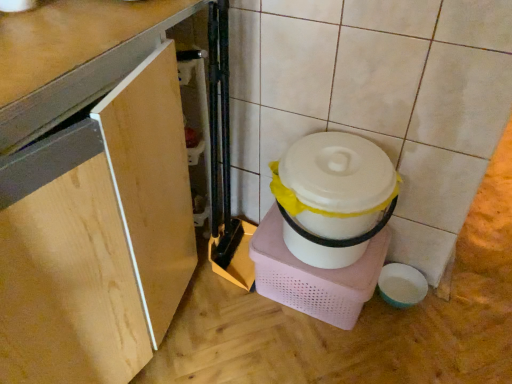
What do you see at coordinates (91, 190) in the screenshot? Image resolution: width=512 pixels, height=384 pixels. I see `wooden cabinet at lower left` at bounding box center [91, 190].

This screenshot has width=512, height=384. I want to click on wooden cabinet at lower left, so click(91, 190).

What do you see at coordinates (333, 196) in the screenshot?
I see `white plastic container at center-right` at bounding box center [333, 196].

Where is `white plastic container at center-right`? The height and width of the screenshot is (384, 512). white plastic container at center-right is located at coordinates (333, 196).

In order to click on wooden cabinet at lower left in this screenshot , I will do `click(91, 190)`.

Between white plastic container at center-right and wooden cabinet at lower left, which one appears on the left side from the viewer's perspective?

wooden cabinet at lower left is more to the left.

Which object is more forward, white plastic container at center-right or wooden cabinet at lower left?

wooden cabinet at lower left is more forward.

Between point (324, 140) and point (181, 136), which one is positioned behind?

The point (324, 140) is behind.

From the image's perspective, is white plastic container at center-right positioned above or below wooden cabinet at lower left?

Based on their image positions, white plastic container at center-right is located beneath wooden cabinet at lower left.

From a real-world perspective, is white plastic container at center-right physically above wooden cabinet at lower left?

No.

Looking at their sizes, would you say white plastic container at center-right is wider or thinner than wooden cabinet at lower left?

In the image, white plastic container at center-right appears to be more narrow than wooden cabinet at lower left.

From their relative heights in the image, would you say white plastic container at center-right is taller or shorter than wooden cabinet at lower left?

Clearly, white plastic container at center-right is shorter compared to wooden cabinet at lower left.

Considering the sizes of white plastic container at center-right and wooden cabinet at lower left in the image, is white plastic container at center-right bigger or smaller than wooden cabinet at lower left?

Clearly, white plastic container at center-right is smaller in size than wooden cabinet at lower left.

Is white plastic container at center-right positioned beyond the bounds of wooden cabinet at lower left?

Yes, white plastic container at center-right is located beyond the bounds of wooden cabinet at lower left.

Is white plastic container at center-right in contact with wooden cabinet at lower left?

They are not placed beside each other.

Is white plastic container at center-right facing towards wooden cabinet at lower left?

No.

What's the angular difference between white plastic container at center-right and wooden cabinet at lower left's facing directions?

The angular difference between white plastic container at center-right and wooden cabinet at lower left is 90.5 degrees.

Measure the distance between white plastic container at center-right and wooden cabinet at lower left.

They are 16.48 inches apart.

This screenshot has height=384, width=512. I want to click on cabinetry lying on the left of white plastic container at center-right, so [91, 190].

Which object is positioned more to the right, wooden cabinet at lower left or white plastic container at center-right?

Positioned to the right is white plastic container at center-right.

Considering their positions, is wooden cabinet at lower left located in front of or behind white plastic container at center-right?

Visually, wooden cabinet at lower left is located in front of white plastic container at center-right.

Which is behind, point (109, 345) or point (288, 231)?

The point (288, 231) is behind.

From the image's perspective, between wooden cabinet at lower left and white plastic container at center-right, who is located below?

From the image's view, white plastic container at center-right is below.

From a real-world perspective, is wooden cabinet at lower left positioned above or below white plastic container at center-right?

In terms of real-world spatial position, wooden cabinet at lower left is above white plastic container at center-right.

Can you confirm if wooden cabinet at lower left is thinner than white plastic container at center-right?

Incorrect, the width of wooden cabinet at lower left is not less than that of white plastic container at center-right.

Considering the relative sizes of wooden cabinet at lower left and white plastic container at center-right in the image provided, is wooden cabinet at lower left taller than white plastic container at center-right?

Correct, wooden cabinet at lower left is much taller as white plastic container at center-right.

Based on the photo, which of these two, wooden cabinet at lower left or white plastic container at center-right, is bigger?

A: wooden cabinet at lower left.

Could white plastic container at center-right be considered to be inside wooden cabinet at lower left?

No, white plastic container at center-right is not inside wooden cabinet at lower left.

Are wooden cabinet at lower left and white plastic container at center-right beside each other?

No, wooden cabinet at lower left is not in contact with white plastic container at center-right.

Is wooden cabinet at lower left aimed at white plastic container at center-right?

Yes.

In the scene shown: Can you tell me how much wooden cabinet at lower left and white plastic container at center-right differ in facing direction?

There is a 90.5-degree angle between the facing directions of wooden cabinet at lower left and white plastic container at center-right.

Where is `cabinetry that is on the left side of white plastic container at center-right`? The image size is (512, 384). cabinetry that is on the left side of white plastic container at center-right is located at coordinates (91, 190).

Find the location of a particular element. The image size is (512, 384). appliance that is below the wooden cabinet at lower left (from the image's perspective) is located at coordinates (333, 196).

You are a GUI agent. You are given a task and a screenshot of the screen. Output one action in this format:
    pyautogui.click(x=<x>, y=<y>)
    Task: Click on the appliance below the wooden cabinet at lower left (from a real-world perspective)
    
    Given the screenshot: What is the action you would take?
    (x=333, y=196)